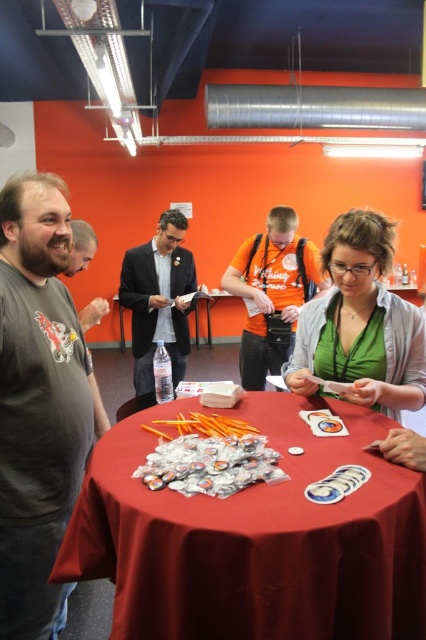
Question: Can you confirm if red fabric tablecloth at center is bigger than matte black suit at center?

Choices:
 (A) no
 (B) yes

Answer: (B)

Question: Does green matte shirt at center have a larger size compared to orange cotton t-shirt at center?

Choices:
 (A) no
 (B) yes

Answer: (A)

Question: Is the position of green matte shirt at center less distant than that of orange cotton t-shirt at center?

Choices:
 (A) no
 (B) yes

Answer: (B)

Question: Which of the following is the closest to the observer?

Choices:
 (A) orange cotton t-shirt at center
 (B) dark gray t-shirt at left
 (C) matte black suit at center

Answer: (B)

Question: Which object is positioned closest to the green matte shirt at center?

Choices:
 (A) dark gray t-shirt at left
 (B) orange cotton t-shirt at center

Answer: (A)

Question: Which of the following is the farthest from the observer?

Choices:
 (A) matte black suit at center
 (B) orange cotton t-shirt at center

Answer: (B)